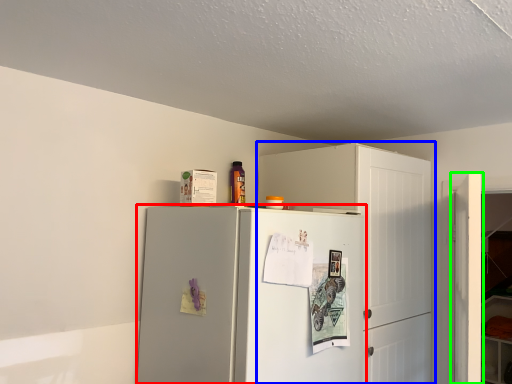
Question: Estimate the real-world distances between objects in this image. Which object is farther from refrigerator (highlighted by a red box), cabinetry (highlighted by a blue box) or door (highlighted by a green box)?

Choices:
 (A) cabinetry
 (B) door

Answer: (B)